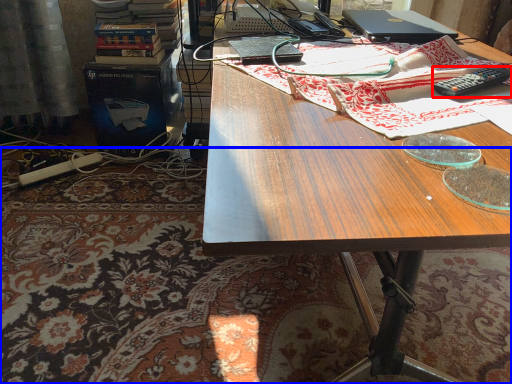
Question: Which object is closer to the camera taking this photo, remote control (highlighted by a red box) or mat (highlighted by a blue box)?

Choices:
 (A) remote control
 (B) mat

Answer: (A)